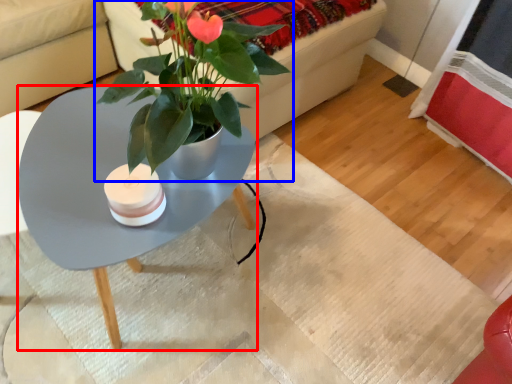
Question: Among these objects, which one is farthest to the camera, coffee table (highlighted by a red box) or houseplant (highlighted by a blue box)?

Choices:
 (A) coffee table
 (B) houseplant

Answer: (B)